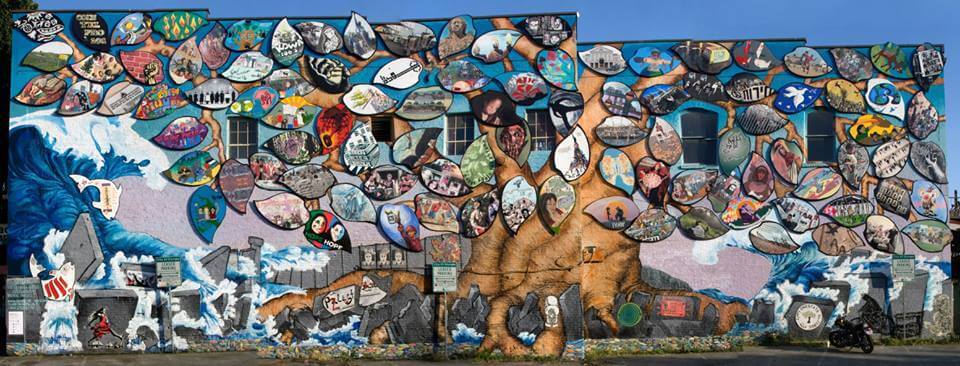
This screenshot has width=960, height=366. Identify the location of window. (242, 135), (462, 125), (697, 135).